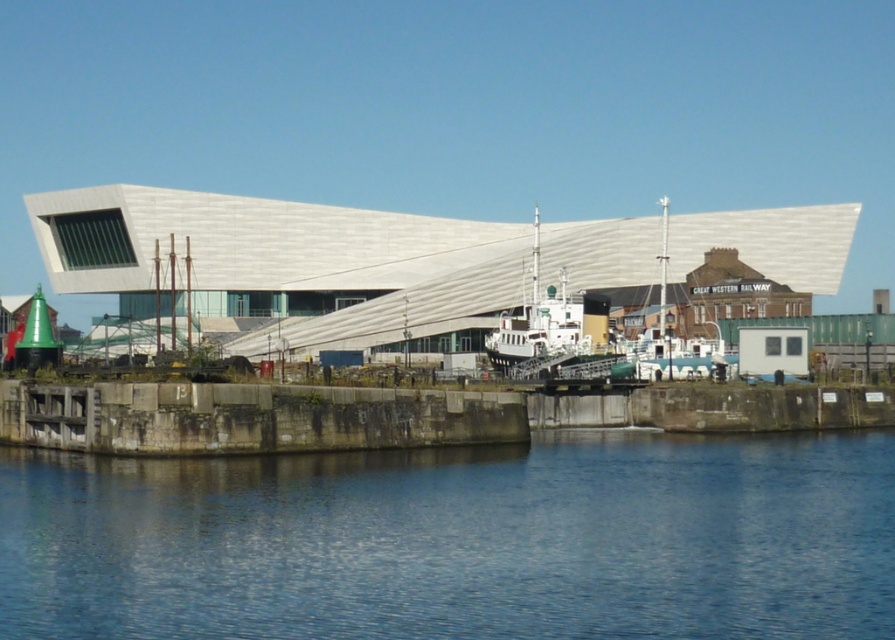
Is blue smooth water at lower center to the right of white matte boat at center from the viewer's perspective?

Incorrect, blue smooth water at lower center is not on the right side of white matte boat at center.

Is blue smooth water at lower center shorter than white matte boat at center?

Yes.

What do you see at coordinates (458, 540) in the screenshot?
I see `blue smooth water at lower center` at bounding box center [458, 540].

Locate an element on the screen. Image resolution: width=895 pixels, height=640 pixels. blue smooth water at lower center is located at coordinates (458, 540).

In the scene shown: Can you confirm if white matte boat at center is positioned to the left of white wooden boat at center?

Correct, you'll find white matte boat at center to the left of white wooden boat at center.

Who is higher up, white matte boat at center or white wooden boat at center?

white wooden boat at center

Who is more forward, (586,346) or (692,344)?

Positioned in front is point (692,344).

At what (x,y) coordinates should I click in order to perform the action: click on white matte boat at center. Please return your answer as a coordinate pair (x, y). The image size is (895, 640). Looking at the image, I should click on (538, 321).

Does blue smooth water at lower center have a larger size compared to white wooden boat at center?

No.

Is blue smooth water at lower center further to the viewer compared to white wooden boat at center?

No, it is not.

Does point (282, 515) lie in front of point (640, 371)?

Yes, it is in front of point (640, 371).

This screenshot has height=640, width=895. Identify the location of blue smooth water at lower center. (458, 540).